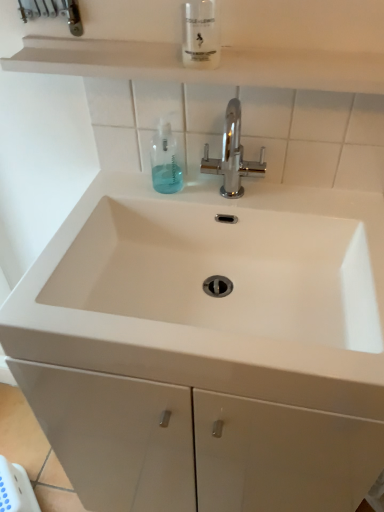
Where is `vacant area to the right of translucent plastic mouthwash at center, placed as the 2th mouthwash when sorted from top to bottom`? vacant area to the right of translucent plastic mouthwash at center, placed as the 2th mouthwash when sorted from top to bottom is located at coordinates (242, 194).